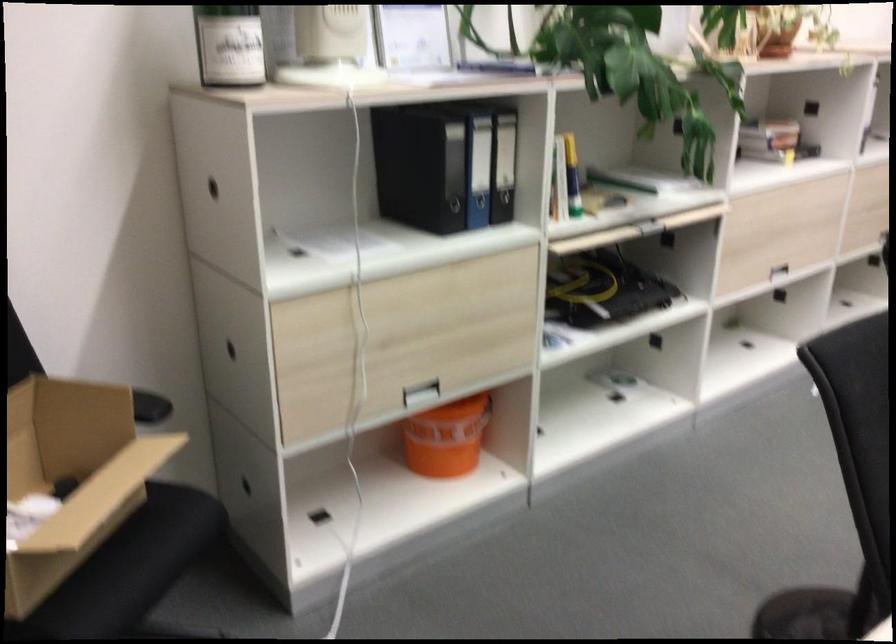
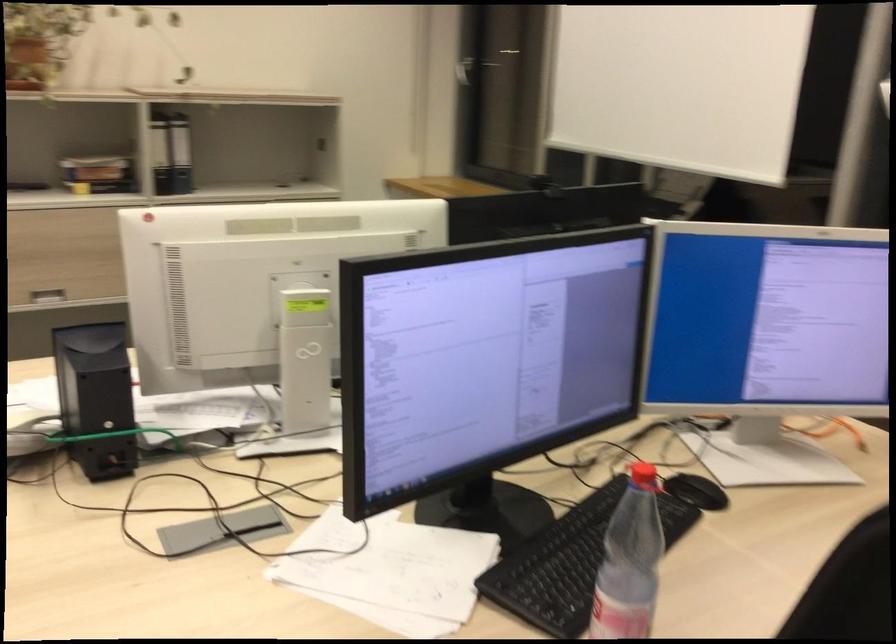
Question: I am providing you with two images of the same scene from different viewpoints. After the viewpoint changes to image2, which objects are now occluded?

Choices:
 (A) black speaker
 (B) red bottle cap
 (C) black computer mouse
 (D) none of these

Answer: (D)